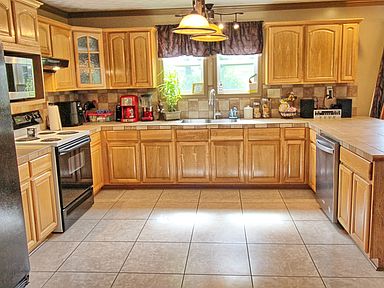
Locate what you would grab to open the dishwasher in the image. Your answer should be formatted as a list of tuples, i.e. [(x1, y1), (x2, y2), ...], where each tuple contains the x and y coordinates of a point satisfying the conditions above.

[(322, 147)]